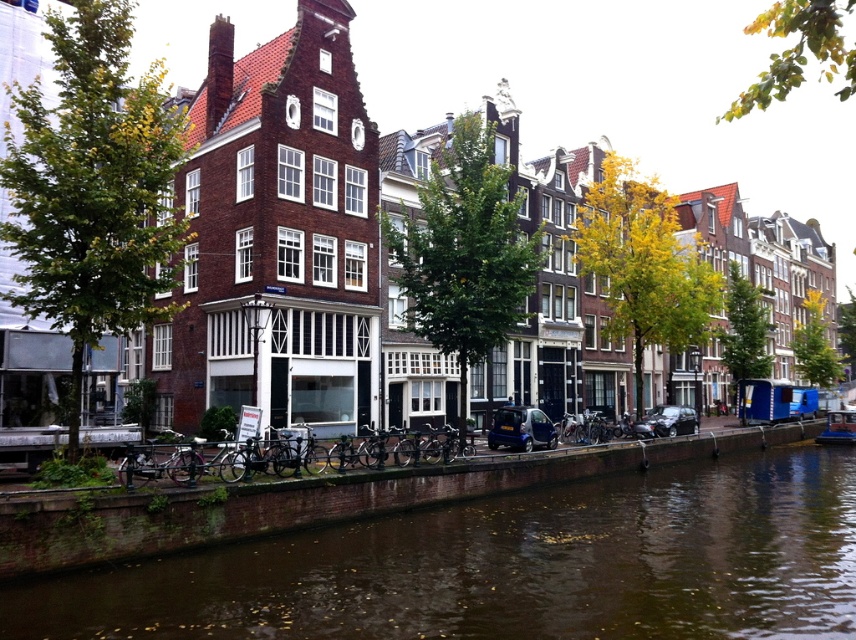
Can you confirm if brown water at lower center is shorter than blue plastic boat at right?

Correct, brown water at lower center is not as tall as blue plastic boat at right.

Between brown water at lower center and blue plastic boat at right, which one is positioned higher?

blue plastic boat at right

At what (x,y) coordinates should I click in order to perform the action: click on brown water at lower center. Please return your answer as a coordinate pair (x, y). Image resolution: width=856 pixels, height=640 pixels. Looking at the image, I should click on (510, 564).

At what (x,y) coordinates should I click in order to perform the action: click on brown water at lower center. Please return your answer as a coordinate pair (x, y). This screenshot has width=856, height=640. Looking at the image, I should click on (510, 564).